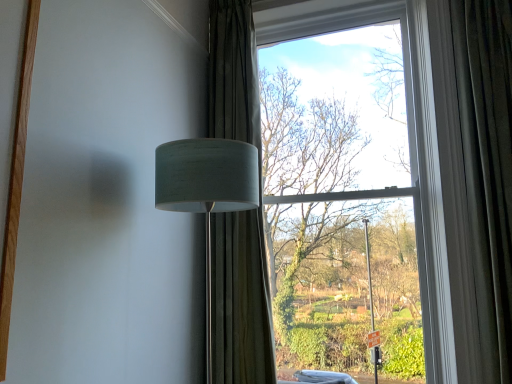
Question: Is velvet dark green curtain at right, which appears as the 2th curtain when viewed from the left, outside of white fabric lampshade at left?

Choices:
 (A) yes
 (B) no

Answer: (A)

Question: From a real-world perspective, is velvet dark green curtain at right, which is the first curtain from right to left, positioned under white fabric lampshade at left based on gravity?

Choices:
 (A) no
 (B) yes

Answer: (A)

Question: Is velvet dark green curtain at right, which appears as the 2th curtain when viewed from the left, oriented away from white fabric lampshade at left?

Choices:
 (A) yes
 (B) no

Answer: (B)

Question: Is there a large distance between velvet dark green curtain at right, which is the first curtain from right to left, and white fabric lampshade at left?

Choices:
 (A) yes
 (B) no

Answer: (A)

Question: Considering the relative sizes of velvet dark green curtain at right, which appears as the 2th curtain when viewed from the left, and white fabric lampshade at left in the image provided, is velvet dark green curtain at right, which appears as the 2th curtain when viewed from the left, shorter than white fabric lampshade at left?

Choices:
 (A) yes
 (B) no

Answer: (B)

Question: Looking at their shapes, would you say velvet dark green curtain at right, which is the first curtain from right to left, is wider or thinner than white fabric lampshade at left?

Choices:
 (A) thin
 (B) wide

Answer: (A)

Question: Is velvet dark green curtain at right, which appears as the 2th curtain when viewed from the left, bigger or smaller than white fabric lampshade at left?

Choices:
 (A) small
 (B) big

Answer: (A)

Question: In the image, is velvet dark green curtain at right, which appears as the 2th curtain when viewed from the left, on the left side or the right side of white fabric lampshade at left?

Choices:
 (A) left
 (B) right

Answer: (B)

Question: From the image's perspective, is velvet dark green curtain at right, which appears as the 2th curtain when viewed from the left, positioned above or below white fabric lampshade at left?

Choices:
 (A) above
 (B) below

Answer: (A)

Question: Would you say green textured curtain at center, the 2th curtain viewed from the right, is inside or outside white fabric lampshade at left?

Choices:
 (A) outside
 (B) inside

Answer: (A)

Question: Considering the positions of green textured curtain at center, the 2th curtain viewed from the right, and white fabric lampshade at left in the image, is green textured curtain at center, the 2th curtain viewed from the right, wider or thinner than white fabric lampshade at left?

Choices:
 (A) thin
 (B) wide

Answer: (A)

Question: Is point (245, 79) positioned closer to the camera than point (244, 208)?

Choices:
 (A) farther
 (B) closer

Answer: (A)

Question: In the image, is green textured curtain at center, marked as the 1th curtain in a left-to-right arrangement, on the left side or the right side of white fabric lampshade at left?

Choices:
 (A) right
 (B) left

Answer: (A)

Question: Considering the positions of velvet dark green curtain at right, which is the first curtain from right to left, and green textured curtain at center, the 2th curtain viewed from the right, in the image, is velvet dark green curtain at right, which is the first curtain from right to left, bigger or smaller than green textured curtain at center, the 2th curtain viewed from the right,?

Choices:
 (A) big
 (B) small

Answer: (B)

Question: From the image's perspective, is velvet dark green curtain at right, which appears as the 2th curtain when viewed from the left, positioned above or below green textured curtain at center, the 2th curtain viewed from the right?

Choices:
 (A) above
 (B) below

Answer: (B)